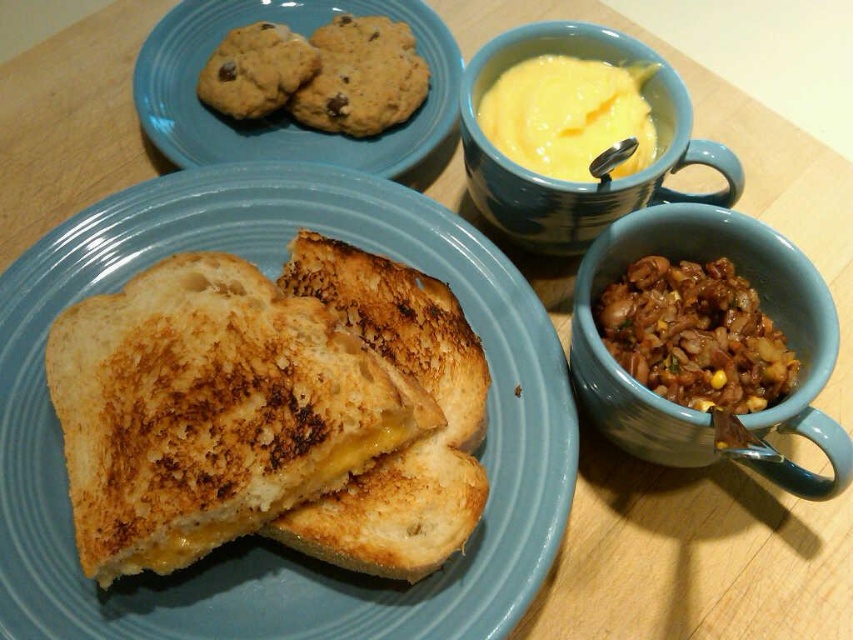
Question: Which of these objects is positioned farthest from the yellow matte mug at upper center?

Choices:
 (A) brown matte rice at lower right
 (B) brown crumbly cookie at upper left
 (C) brown matte mug at center-right
 (D) yellow creamy mustard in bowl at upper center

Answer: (B)

Question: Which object appears closest to the camera in this image?

Choices:
 (A) golden brown toasted bread at center
 (B) yellow matte mug at upper center
 (C) golden brown cookie with chocolate chips at upper left

Answer: (A)

Question: Is golden brown toasted bread at center positioned in front of brown matte mug at center-right?

Choices:
 (A) yes
 (B) no

Answer: (A)

Question: Observing the image, what is the correct spatial positioning of brown matte rice at lower right in reference to brown crumbly cookie at upper left?

Choices:
 (A) left
 (B) right

Answer: (B)

Question: Does brown matte mug at center-right have a larger size compared to brown matte rice at lower right?

Choices:
 (A) no
 (B) yes

Answer: (B)

Question: Among these objects, which one is nearest to the camera?

Choices:
 (A) brown matte mug at center-right
 (B) golden brown cookie with chocolate chips at upper left
 (C) yellow matte mug at upper center
 (D) matte ceramic plate at center

Answer: (A)